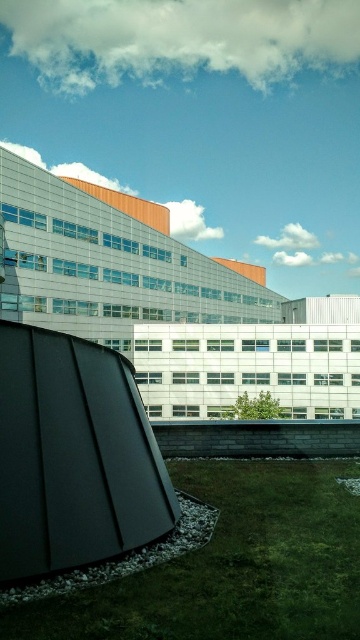
You are standing in front of the modern building and notice two points marked in the scene. The first point is at coordinate point (318, 525) and the second is at point (24, 556). Which of these two points is closer to your current position?

Point (24, 556) is closer to your current position because it is closer to the camera than point (318, 525), which is further away.

You are standing at the base of the curved dark gray metallic structure in the foreground of the modern architectural scene. You want to walk directly towards the green grass at lower center located at point (231, 564). Is the path clear of any obstacles between your current position and the green grass at lower center?

The path between the curved dark gray metallic structure in the foreground and the green grass at lower center located at point (231, 564) is clear of any obstacles as the scene description mentions only the grass is bordered by small white stones, so you can walk directly towards it.